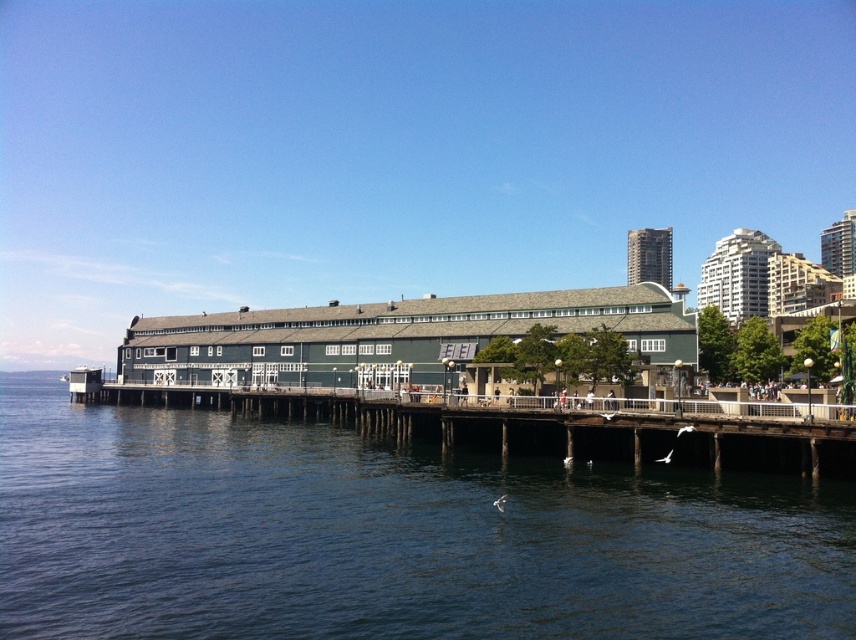
You are a delivery drone with a wingspan of 3 meters. You need to fly from the dark blue water at lower center to the brown wooden dock at center. Can you safely navigate the space between them?

The distance between the dark blue water at lower center and the brown wooden dock at center is 38.18 feet, which is approximately 11.6 meters. Since your wingspan is 3 meters, there is sufficient space to navigate safely between them.

You are standing on the brown wooden dock at center and want to cross to the other side. Given that the dark blue water at lower center is wider than the dock, can you safely walk across the water?

The dark blue water at lower center is wider than the brown wooden dock at center, so it is not possible to safely walk across the water since it is wider than the dock.